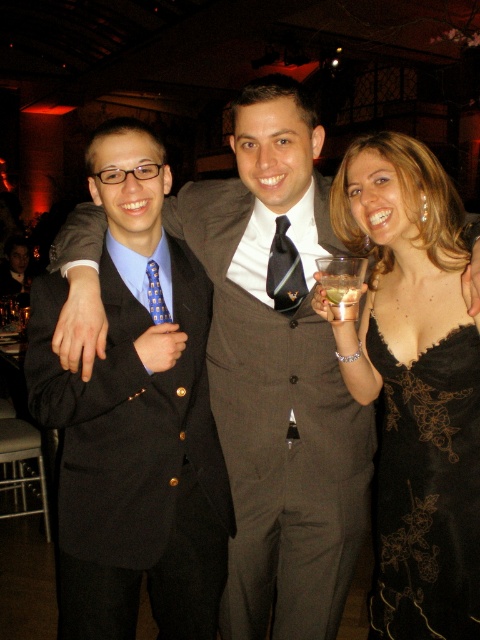
Which is more to the right, black lace dress at lower right or translucent glass at center?

From the viewer's perspective, black lace dress at lower right appears more on the right side.

Consider the image. Can you confirm if black lace dress at lower right is bigger than translucent glass at center?

Indeed, black lace dress at lower right has a larger size compared to translucent glass at center.

Is point (435, 573) positioned after point (339, 284)?

Yes, it is.

Locate an element on the screen. black lace dress at lower right is located at coordinates (427, 490).

Is black satin suit at left taller than translucent glass at center?

Correct, black satin suit at left is much taller as translucent glass at center.

Who is lower down, black satin suit at left or translucent glass at center?

black satin suit at left

Identify the location of black satin suit at left. The image size is (480, 640). (134, 419).

Where is `black satin suit at left`? black satin suit at left is located at coordinates (134, 419).

Between black silk tie at center and clear plastic wine glass at center, which one appears on the left side from the viewer's perspective?

From the viewer's perspective, black silk tie at center appears more on the left side.

Can you confirm if black silk tie at center is shorter than clear plastic wine glass at center?

No, black silk tie at center is not shorter than clear plastic wine glass at center.

Which is in front, point (284, 224) or point (337, 304)?

Positioned in front is point (337, 304).

Where is `black silk tie at center`? This screenshot has height=640, width=480. black silk tie at center is located at coordinates (285, 269).